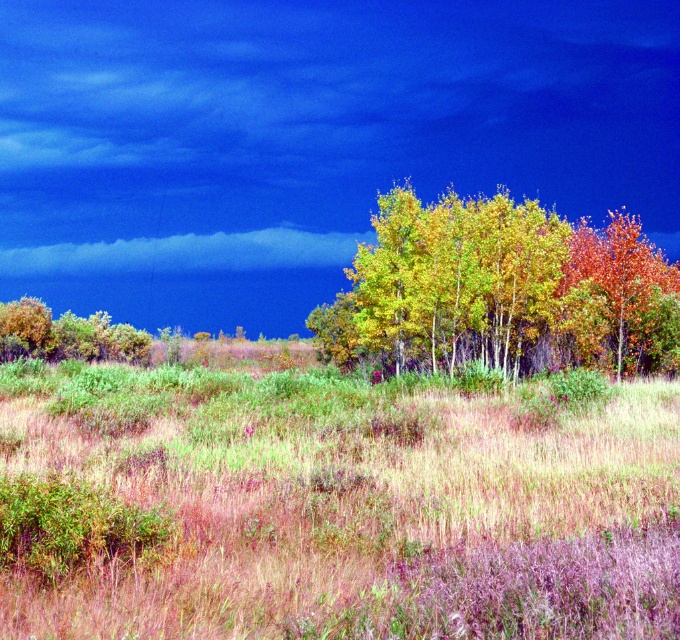
Question: Which of the following is the farthest from the observer?

Choices:
 (A) dry grass at center
 (B) green leafy tree at left

Answer: (B)

Question: Among these points, which one is nearest to the camera?

Choices:
 (A) (175, 477)
 (B) (284, 234)
 (C) (558, 262)

Answer: (A)

Question: Which of these objects is positioned closest to the dry grass at center?

Choices:
 (A) golden yellow leaves at center
 (B) cloudy blue sky at upper center

Answer: (A)

Question: Can you confirm if golden yellow leaves at center is positioned above green leafy tree at left?

Choices:
 (A) no
 (B) yes

Answer: (B)

Question: Does dry grass at center have a smaller size compared to green leafy tree at left?

Choices:
 (A) yes
 (B) no

Answer: (B)

Question: Does dry grass at center appear on the right side of green leafy tree at left?

Choices:
 (A) yes
 (B) no

Answer: (A)